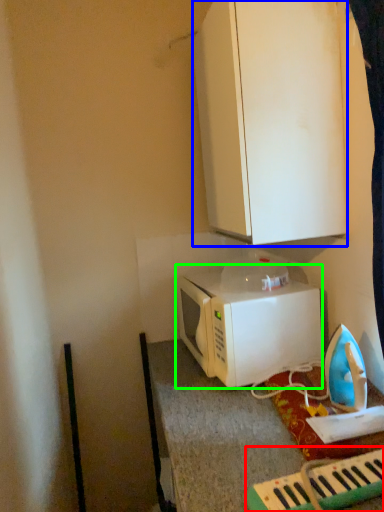
Question: Based on their relative distances, which object is nearer to musical keyboard (highlighted by a red box)? Choose from cabinetry (highlighted by a blue box) and microwave oven (highlighted by a green box).

Choices:
 (A) cabinetry
 (B) microwave oven

Answer: (B)